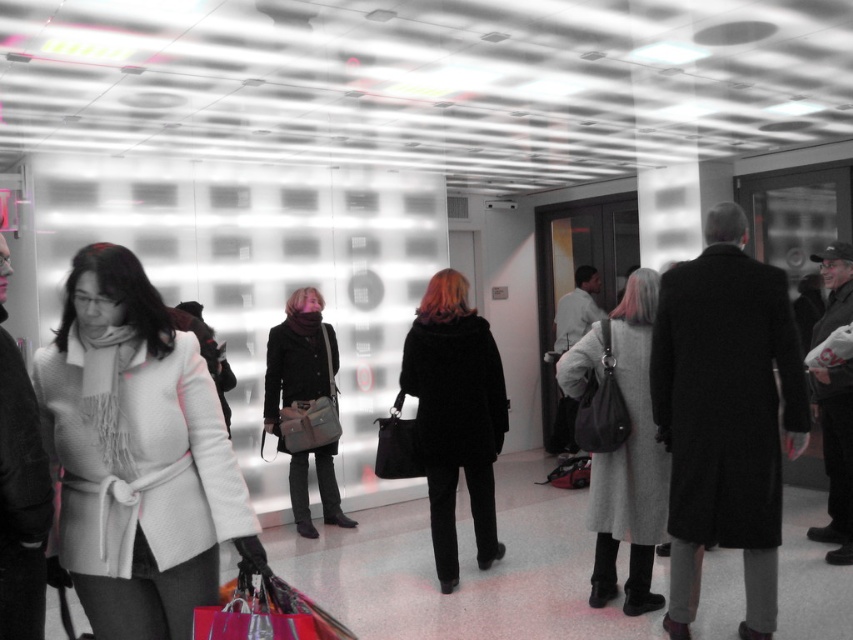
Consider the image. Does white wool coat at center have a lesser width compared to black fur coat at center?

No, white wool coat at center is not thinner than black fur coat at center.

Which is above, white wool coat at center or black fur coat at center?

Positioned higher is white wool coat at center.

The image size is (853, 640). In order to click on white wool coat at center in this screenshot , I will do `click(137, 454)`.

Can you confirm if gray wool coat at center is positioned to the left of matte black coat at center?

No, gray wool coat at center is not to the left of matte black coat at center.

How distant is gray wool coat at center from matte black coat at center?

gray wool coat at center and matte black coat at center are 6.91 feet apart.

Does point (622, 320) come behind point (294, 353)?

No.

I want to click on gray wool coat at center, so click(x=619, y=442).

Which is more to the right, white wool coat at center or gray wool coat at center?

gray wool coat at center is more to the right.

Is white wool coat at center to the right of gray wool coat at center from the viewer's perspective?

In fact, white wool coat at center is to the left of gray wool coat at center.

Is point (206, 509) farther from viewer compared to point (630, 532)?

No.

Identify the location of white wool coat at center. The height and width of the screenshot is (640, 853). (137, 454).